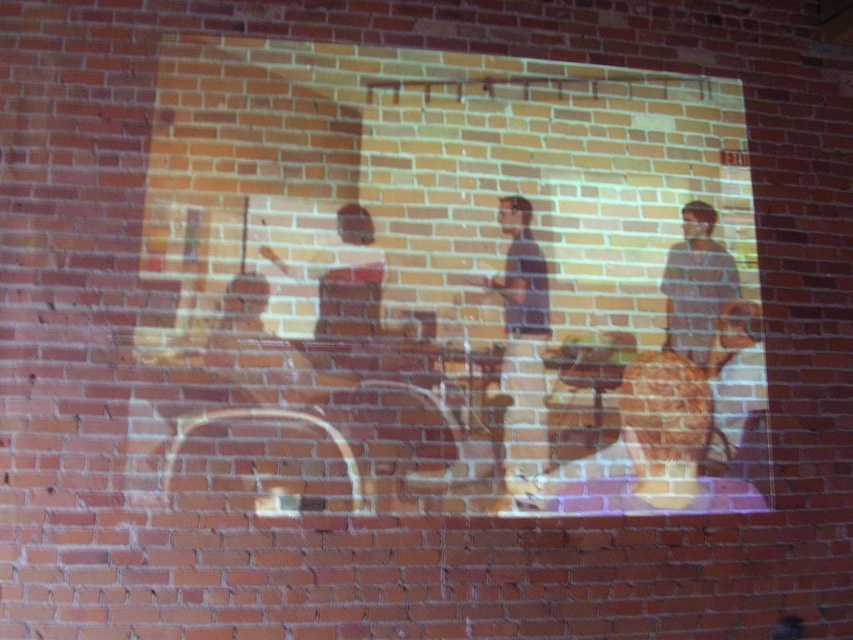
You are standing in front of the projected scene on the brick wall. You notice a point at coordinates (677,445). Which object in the projected scene does this point belong to?

The point at coordinates (677,445) belongs to the matte brown guitar at center.

You are a photographer standing in front of the brick wall where the projection is displayed. You want to take a closeup photo of the matte brown guitar at center and the dark blue shirt at center. Considering their distance, will the two objects fit within the camera frame if the camera has a maximum field of view of 10 inches?

The matte brown guitar at center is 10.82 inches from the dark blue shirt at center, which exceeds the camera frame limit of 10 inches. Therefore, the two objects will not fit within the frame.